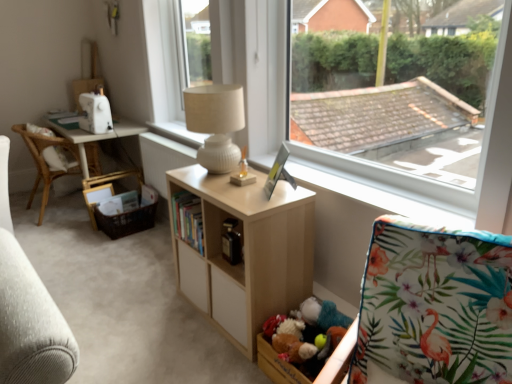
This screenshot has height=384, width=512. What do you see at coordinates (48, 161) in the screenshot?
I see `rattan chair at left` at bounding box center [48, 161].

Measure the distance between rattan chair at left and camera.

rattan chair at left and camera are 11.54 feet apart from each other.

In order to face white plastic window frame at upper center, should I rotate leftwards or rightwards?

It's best to rotate left around 9.074 degrees.

This screenshot has width=512, height=384. Find the location of `white ribbed ceramic lamp at upper center`. white ribbed ceramic lamp at upper center is located at coordinates (216, 124).

What do you see at coordinates (177, 133) in the screenshot?
I see `white textured lamp at upper center` at bounding box center [177, 133].

Image resolution: width=512 pixels, height=384 pixels. What are the coordinates of `transparent glass window at upper center` in the screenshot? It's located at (446, 183).

This screenshot has height=384, width=512. I want to click on rattan chair at left, so click(x=48, y=161).

Considering the relative positions of rattan chair at left and white wood table at left in the image provided, is rattan chair at left to the left of white wood table at left from the viewer's perspective?

Yes.

Where is `table on the right of rattan chair at left`? The width and height of the screenshot is (512, 384). table on the right of rattan chair at left is located at coordinates (99, 140).

From a real-world perspective, does rattan chair at left stand above white wood table at left?

Correct, in the physical world, rattan chair at left is higher than white wood table at left.

Is point (47, 160) closer to camera compared to point (81, 137)?

No, it is not.

From a real-world perspective, does white ribbed ceramic lamp at upper center stand above wooden toy box at lower center?

Yes.

How different are the orientations of white ribbed ceramic lamp at upper center and wooden toy box at lower center in degrees?

The angular difference between white ribbed ceramic lamp at upper center and wooden toy box at lower center is 0.105 degrees.

Can you confirm if white ribbed ceramic lamp at upper center is bigger than wooden toy box at lower center?

Correct, white ribbed ceramic lamp at upper center is larger in size than wooden toy box at lower center.

Is wooden toy box at lower center inside white ribbed ceramic lamp at upper center?

No, white ribbed ceramic lamp at upper center does not contain wooden toy box at lower center.

Considering the sizes of objects floral fabric rocking chair at lower right and white ribbed ceramic lamp at upper center in the image provided, who is thinner, floral fabric rocking chair at lower right or white ribbed ceramic lamp at upper center?

white ribbed ceramic lamp at upper center.

Does floral fabric rocking chair at lower right have a greater height compared to white ribbed ceramic lamp at upper center?

Yes, floral fabric rocking chair at lower right is taller than white ribbed ceramic lamp at upper center.

Is floral fabric rocking chair at lower right looking in the opposite direction of white ribbed ceramic lamp at upper center?

No, floral fabric rocking chair at lower right's orientation is not away from white ribbed ceramic lamp at upper center.

Looking at this image, how different are the orientations of floral fabric rocking chair at lower right and white ribbed ceramic lamp at upper center in degrees?

floral fabric rocking chair at lower right and white ribbed ceramic lamp at upper center are facing 19.9 degrees away from each other.

Between floral fabric rocking chair at lower right and transparent glass window at upper center, which one has larger size?

transparent glass window at upper center is bigger.

Between floral fabric rocking chair at lower right and transparent glass window at upper center, which one is positioned in front?

Positioned in front is floral fabric rocking chair at lower right.

Can you confirm if floral fabric rocking chair at lower right is taller than transparent glass window at upper center?

In fact, floral fabric rocking chair at lower right may be shorter than transparent glass window at upper center.

Does point (436, 347) come closer to viewer compared to point (366, 172)?

Yes, point (436, 347) is in front of point (366, 172).

Is light wood shelf at center shorter than white ribbed ceramic lamp at upper center?

No.

In terms of width, does light wood shelf at center look wider or thinner when compared to white ribbed ceramic lamp at upper center?

Clearly, light wood shelf at center has more width compared to white ribbed ceramic lamp at upper center.

In the scene shown: Is light wood shelf at center to the right of white ribbed ceramic lamp at upper center from the viewer's perspective?

Yes, light wood shelf at center is to the right of white ribbed ceramic lamp at upper center.

Which is more to the right, transparent glass window at upper center or white wood table at left?

Positioned to the right is transparent glass window at upper center.

From a real-world perspective, who is located higher, transparent glass window at upper center or white wood table at left?

From a 3D spatial view, transparent glass window at upper center is above.

How far apart are transparent glass window at upper center and white wood table at left?

transparent glass window at upper center is 1.53 meters away from white wood table at left.

Is transparent glass window at upper center in front of or behind white wood table at left in the image?

transparent glass window at upper center is in front of white wood table at left.

Can you confirm if wooden toy box at lower center is positioned to the left of white ribbed ceramic lamp at upper center?

No, wooden toy box at lower center is not to the left of white ribbed ceramic lamp at upper center.

Are wooden toy box at lower center and white ribbed ceramic lamp at upper center far apart?

Yes, wooden toy box at lower center and white ribbed ceramic lamp at upper center are located far from each other.

From a real-world perspective, is wooden toy box at lower center positioned under white ribbed ceramic lamp at upper center based on gravity?

Yes.

Is wooden toy box at lower center facing away from white ribbed ceramic lamp at upper center?

No, white ribbed ceramic lamp at upper center is not at the back of wooden toy box at lower center.

The image size is (512, 384). Identify the location of table that appears on the right of rattan chair at left. (x=99, y=140).

Identify the location of lamp that is above the wooden toy box at lower center (from the image's perspective). (216, 124).

Looking at the image, which one is located further to white ribbed ceramic lamp at upper center, light wood shelf at center or white plastic window frame at upper center?

white plastic window frame at upper center is further to white ribbed ceramic lamp at upper center.

Based on their spatial positions, is floral fabric rocking chair at lower right or brown woven picnic basket at lower left further from hardcover books at center?

floral fabric rocking chair at lower right lies further to hardcover books at center than the other object.

Based on their spatial positions, is light wood shelf at center or white ribbed ceramic lamp at upper center further from wooden toy box at lower center?

white ribbed ceramic lamp at upper center is further to wooden toy box at lower center.

Which object lies nearer to the anchor point white wood table at left, rattan chair at left or brown woven picnic basket at lower left?

rattan chair at left.

Estimate the real-world distances between objects in this image. Which object is further from white textured lamp at upper center, white wood table at left or white plastic window frame at upper center?

white plastic window frame at upper center is positioned further to the anchor white textured lamp at upper center.

Based on the photo, looking at the image, which one is located further to white plastic window frame at upper center, hardcover books at center or brown woven picnic basket at lower left?

Based on the image, hardcover books at center appears to be further to white plastic window frame at upper center.

From the image, which object appears to be nearer to hardcover books at center, wooden toy box at lower center or light wood shelf at center?

Based on the image, light wood shelf at center appears to be nearer to hardcover books at center.

Which object lies further to the anchor point floral fabric rocking chair at lower right, rattan chair at left or white ribbed ceramic lamp at upper center?

The object further to floral fabric rocking chair at lower right is rattan chair at left.

Where is `shelf positioned between floral fabric rocking chair at lower right and brown woven picnic basket at lower left from near to far`? The width and height of the screenshot is (512, 384). shelf positioned between floral fabric rocking chair at lower right and brown woven picnic basket at lower left from near to far is located at coordinates (245, 253).

In order to click on lamp between transparent glass window at upper center and hardcover books at center along the z-axis in this screenshot , I will do `click(216, 124)`.

The image size is (512, 384). Identify the location of lamp between light wood shelf at center and white textured lamp at upper center from front to back. (216, 124).

You are a GUI agent. You are given a task and a screenshot of the screen. Output one action in this format:
    pyautogui.click(x=<x>, y=<y>)
    Task: Click on the shelf positioned between wooden toy box at lower center and brown woven picnic basket at lower left from near to far
    
    Given the screenshot: What is the action you would take?
    pyautogui.click(x=245, y=253)